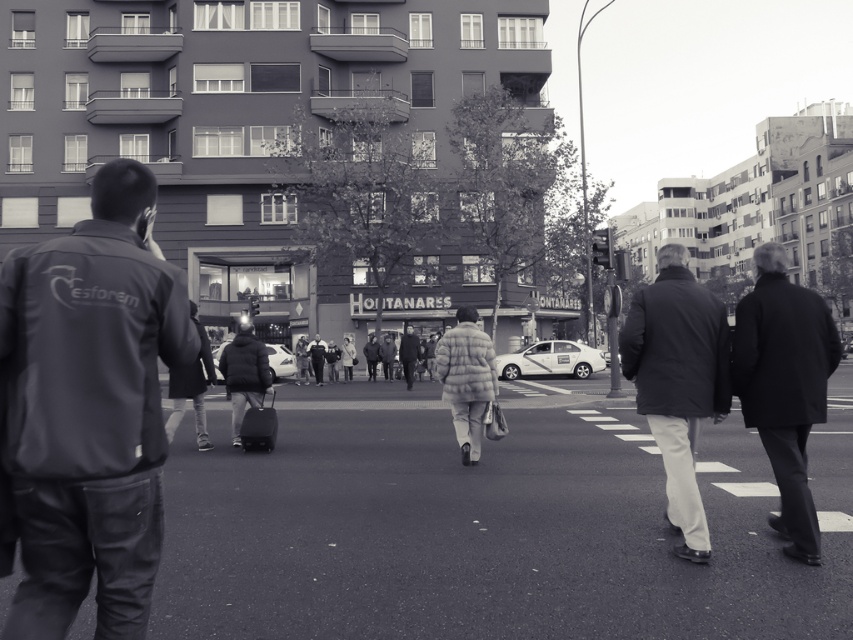
You are a photographer standing on the sidewalk at the city intersection. You notice two people in the crowd wearing a dark wool coat at right and a light gray puffer jacket at center. Which person is positioned higher in the frame?

The dark wool coat at right is positioned higher in the frame than the light gray puffer jacket at center.

You are a delivery person trying to locate a package left at the dark wool coat at right. The package is at the point with coordinates (x=784, y=385). Based on the scene description, where exactly is the package located?

The package is located at the dark wool coat at right, which corresponds to the coordinates point (x=784, y=385).